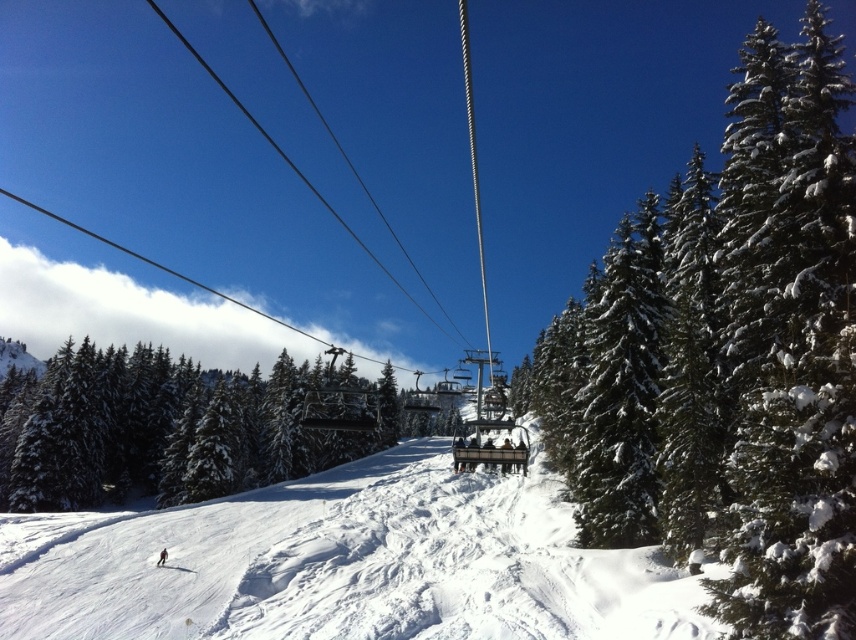
Question: Which point appears closest to the camera in this image?

Choices:
 (A) (724, 170)
 (B) (175, 566)
 (C) (1, 426)

Answer: (A)

Question: Among these objects, which one is nearest to the camera?

Choices:
 (A) green textured pine tree at right
 (B) red snowboard at center
 (C) white snow ski slope at center
 (D) green snow-covered pine at center

Answer: (A)

Question: Does green textured pine tree at right lie behind red snowboard at center?

Choices:
 (A) yes
 (B) no

Answer: (B)

Question: Is green textured pine tree at right wider than red snowboard at center?

Choices:
 (A) no
 (B) yes

Answer: (B)

Question: Can you confirm if white snow ski slope at center is wider than green snow-covered pine at center?

Choices:
 (A) yes
 (B) no

Answer: (B)

Question: Estimate the real-world distances between objects in this image. Which object is farther from the red snowboard at center?

Choices:
 (A) white snowboard at lower center
 (B) white snow ski slope at center
 (C) green snow-covered pine at center
 (D) green textured pine tree at right

Answer: (C)